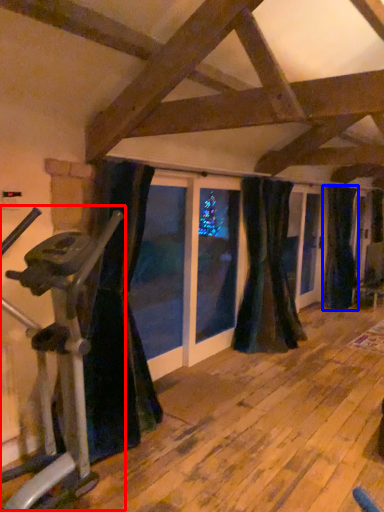
Question: Among these objects, which one is farthest to the camera, stationary bicycle (highlighted by a red box) or curtain (highlighted by a blue box)?

Choices:
 (A) stationary bicycle
 (B) curtain

Answer: (B)